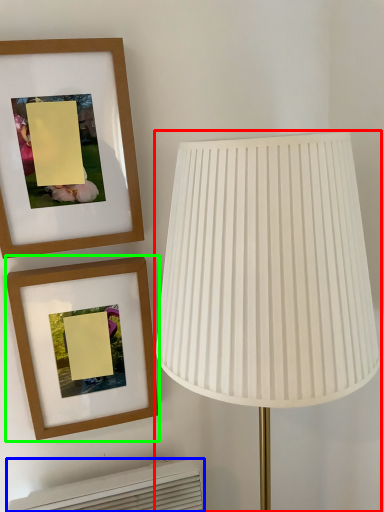
Question: Based on their relative distances, which object is nearer to lamp (highlighted by a red box)? Choose from air conditioner (highlighted by a blue box) and picture frame (highlighted by a green box).

Choices:
 (A) air conditioner
 (B) picture frame

Answer: (B)